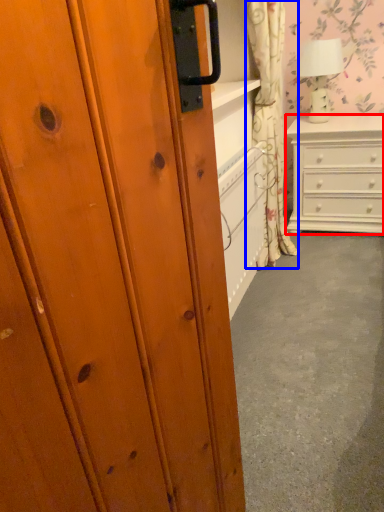
Question: Which point is further to the camera, chest of drawers (highlighted by a red box) or curtain (highlighted by a blue box)?

Choices:
 (A) chest of drawers
 (B) curtain

Answer: (A)